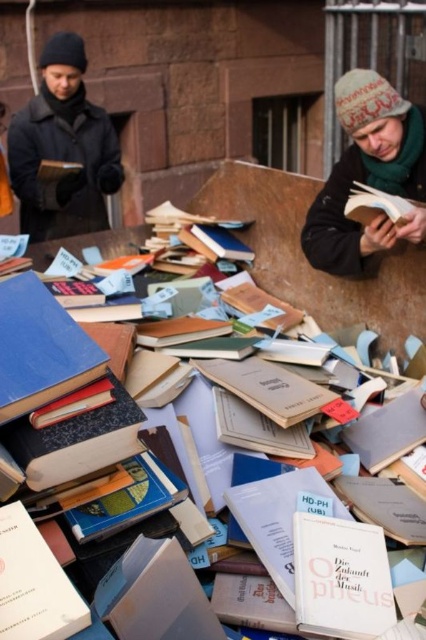
Question: Considering the relative positions of dark blue woolen hat at upper left and white paper book at center in the image provided, where is dark blue woolen hat at upper left located with respect to white paper book at center?

Choices:
 (A) left
 (B) right

Answer: (A)

Question: Which point appears closest to the camera in this image?

Choices:
 (A) (51, 573)
 (B) (325, 228)
 (C) (333, 538)
 (D) (391, 212)

Answer: (A)

Question: Is dark blue woolen hat at upper left positioned in front of hardcover book at lower left?

Choices:
 (A) no
 (B) yes

Answer: (A)

Question: Which point is farther to the camera?

Choices:
 (A) white paper book at center
 (B) hardcover book at lower left
 (C) hardcover book at center
 (D) knitted wool hat at upper right

Answer: (D)

Question: Can you confirm if white paper book at center is bigger than hardcover book at lower left?

Choices:
 (A) yes
 (B) no

Answer: (A)

Question: Among these objects, which one is farthest from the camera?

Choices:
 (A) knitted wool hat at upper right
 (B) white paper book at center
 (C) hardcover book at lower left
 (D) dark blue woolen hat at upper left

Answer: (D)